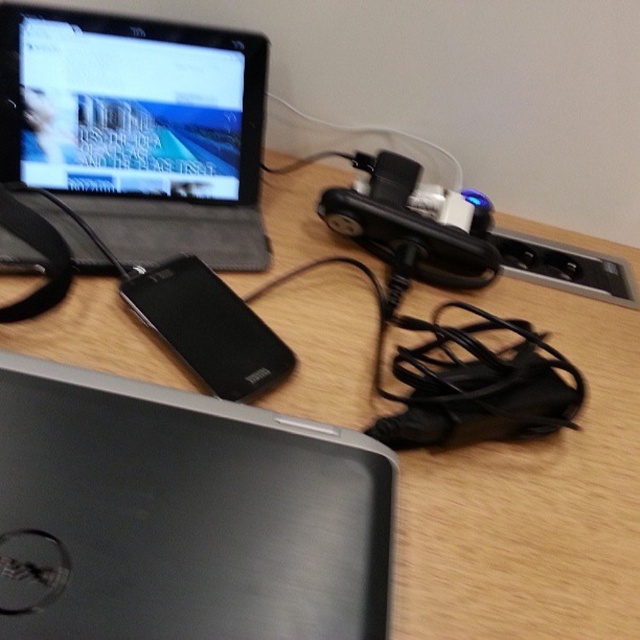
Can you confirm if black brushed metal laptop at center is positioned below black matte speaker at center?

Yes, black brushed metal laptop at center is below black matte speaker at center.

Does point (284, 561) lie in front of point (212, 276)?

Yes.

Which is in front, point (70, 550) or point (193, 371)?

Point (70, 550) is more forward.

This screenshot has width=640, height=640. In order to click on black brushed metal laptop at center in this screenshot , I will do coord(182,515).

Is black brushed metal laptop at center taller than matte black laptop at upper left?

Incorrect, black brushed metal laptop at center's height is not larger of matte black laptop at upper left's.

Does black brushed metal laptop at center appear under matte black laptop at upper left?

Indeed, black brushed metal laptop at center is positioned under matte black laptop at upper left.

Identify the location of black brushed metal laptop at center. click(182, 515).

Who is positioned more to the left, matte black laptop at upper left or black matte speaker at center?

Positioned to the left is matte black laptop at upper left.

Which of these two, matte black laptop at upper left or black matte speaker at center, stands taller?

matte black laptop at upper left is taller.

The height and width of the screenshot is (640, 640). I want to click on matte black laptop at upper left, so click(x=138, y=129).

Identify the location of matte black laptop at upper left. (138, 129).